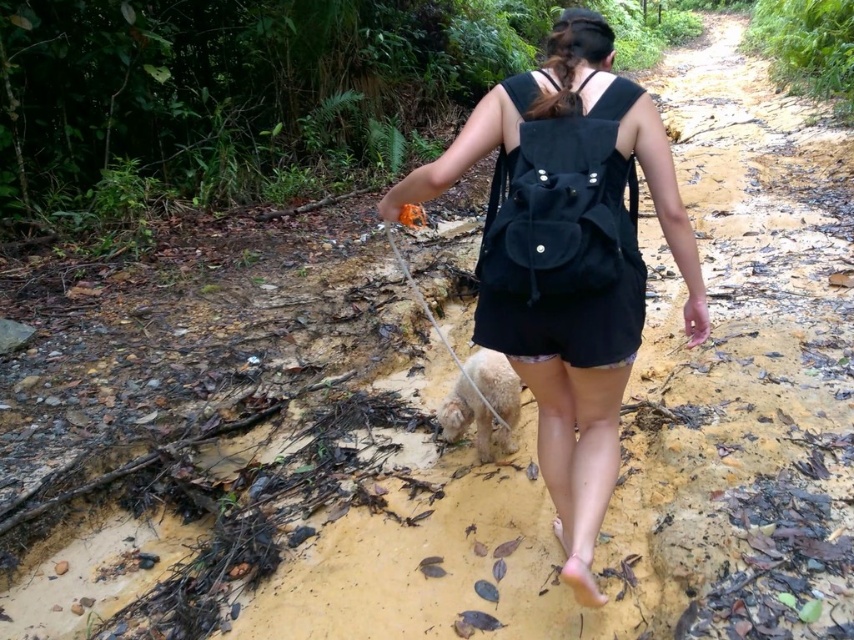
Question: Which object is positioned farthest from the smooth nylon leash at lower center?

Choices:
 (A) black suede backpack at center
 (B) black fabric backpack at center

Answer: (A)

Question: Considering the real-world distances, which object is closest to the black suede backpack at center?

Choices:
 (A) smooth nylon leash at lower center
 (B) black fabric backpack at center

Answer: (B)

Question: Can you confirm if black suede backpack at center is wider than smooth nylon leash at lower center?

Choices:
 (A) no
 (B) yes

Answer: (A)

Question: Which of the following is the closest to the observer?

Choices:
 (A) (494, 412)
 (B) (510, 284)
 (C) (676, 252)

Answer: (B)

Question: Can you confirm if black suede backpack at center is positioned to the right of smooth nylon leash at lower center?

Choices:
 (A) yes
 (B) no

Answer: (A)

Question: Considering the relative positions of black fabric backpack at center and black suede backpack at center in the image provided, where is black fabric backpack at center located with respect to black suede backpack at center?

Choices:
 (A) left
 (B) right

Answer: (A)